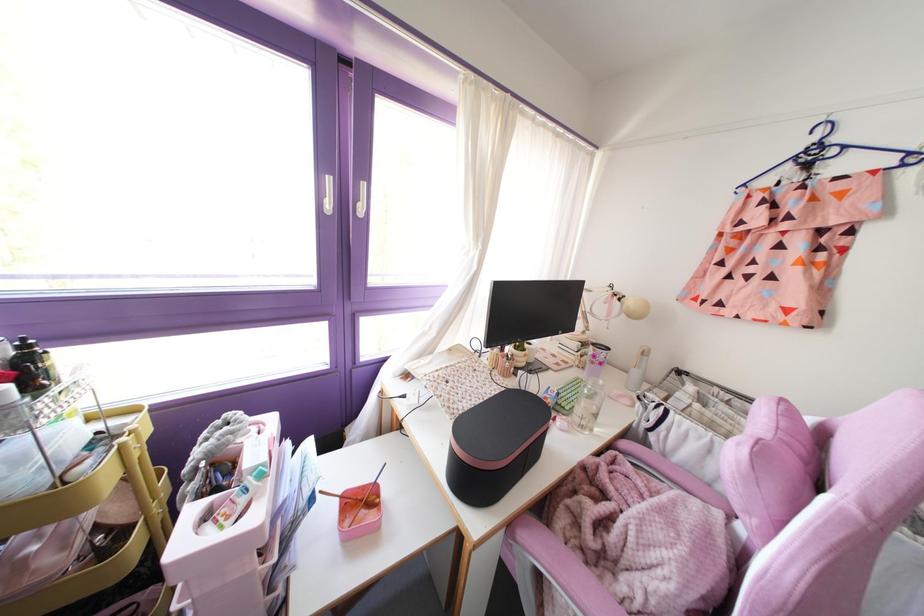
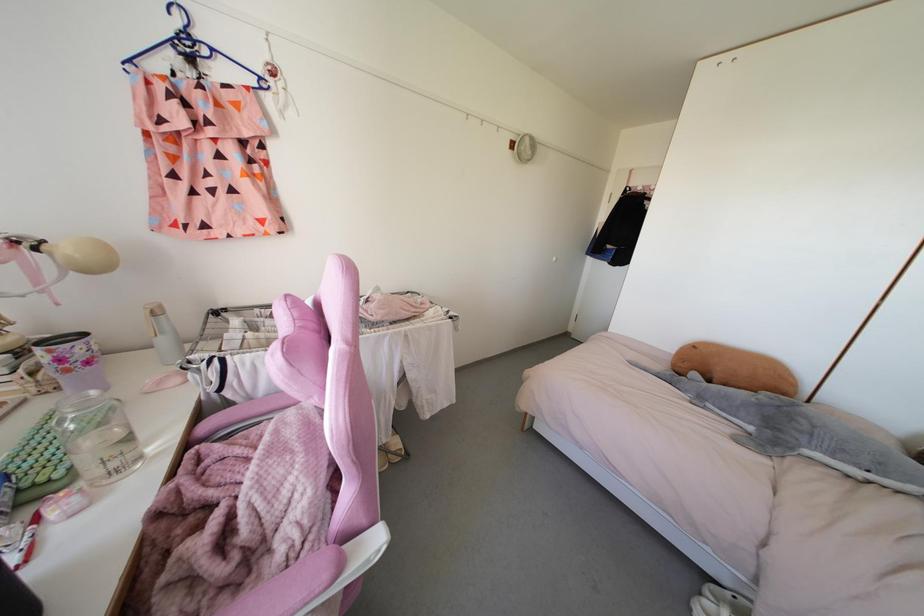
Locate, in the second image, the point that corresponds to the point at 601,382 in the first image.

(92, 392)